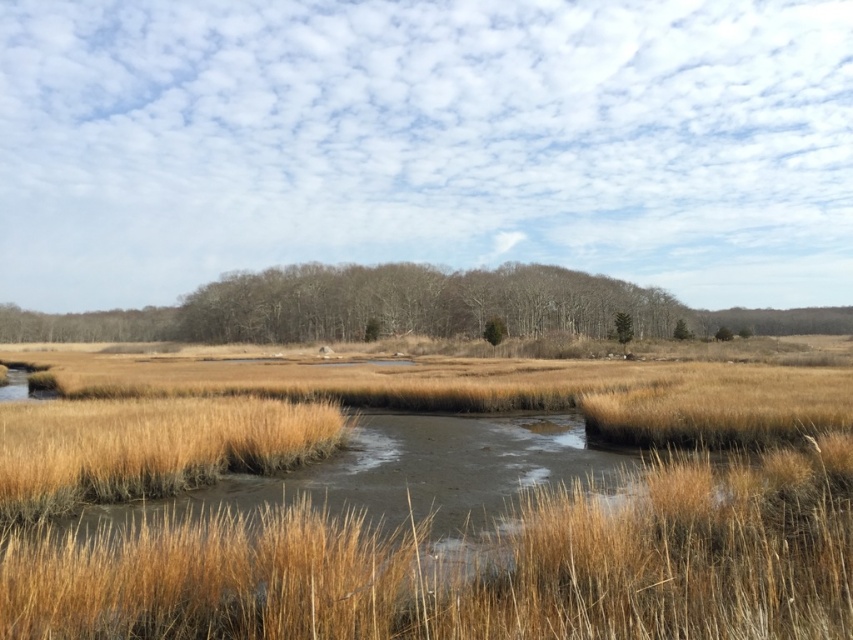
You are standing in the marshy wetland area shown in the image. You see the point at coordinates (416,304). What object is located at that point?

The point at coordinates 0.489, 0.489 corresponds to brown textured trees at center.

You are standing in the marshy wetland and want to reach the dense treeline in the background. According to the scene description, where exactly are the brown textured trees at center located?

The brown textured trees at center are located at point (416, 304).